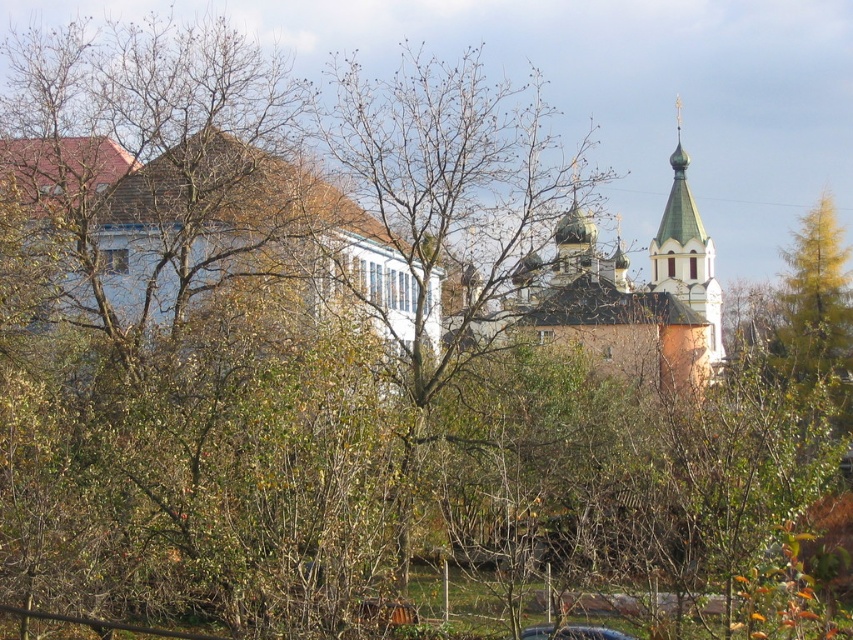
You are standing in the urban landscape and want to take a photo of the green metallic church at upper right. Based on its location coordinates, which direction should you face to capture it in your view?

The green metallic church at upper right is located at coordinates point (625,294), which corresponds to the upper right area of the scene. To capture it in your view, you should face towards the upper right direction.

You are an urban planner assessing the spatial relationship between the white matte building at left and the green metallic church at upper right. Considering their sizes, which one would require more land area for potential expansion without encroaching on the other?

The green metallic church at upper right would require more land area for potential expansion since it is larger than the white matte building at left.

In the scene shown: You are an architect analyzing the urban landscape. You notice the green metallic church at upper right and the green painted wood tower at upper right. Which of these two structures has a greater horizontal span when viewed from your current position?

The green metallic church at upper right has a greater horizontal span than the green painted wood tower at upper right because its width is larger according to the description.